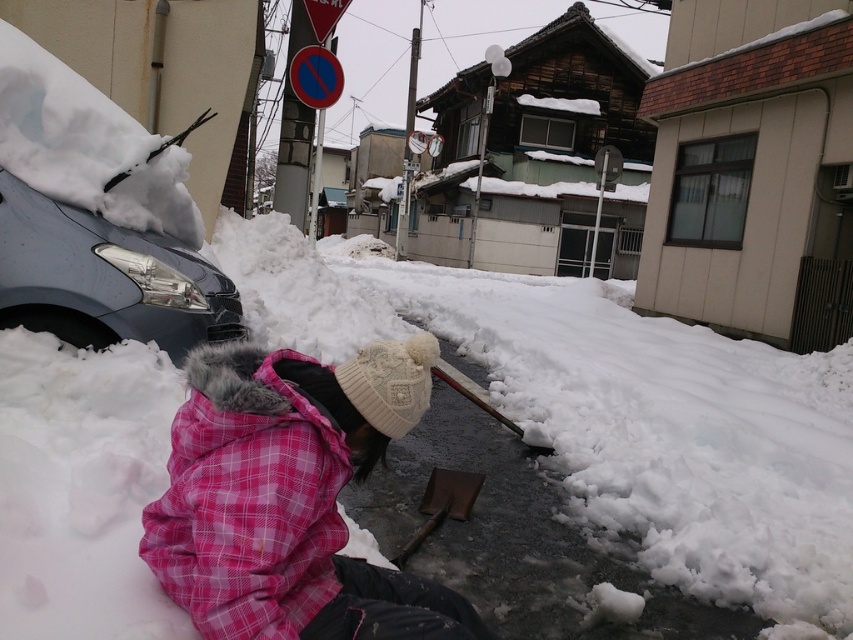
Is white fluffy snow at center above pink fleece jacket at lower left?

Yes.

Is point (152, 362) positioned behind point (231, 435)?

That is True.

Where is `white fluffy snow at center`? The width and height of the screenshot is (853, 640). white fluffy snow at center is located at coordinates (612, 410).

Is point (161, 282) closer to camera compared to point (445, 508)?

No, it is not.

Can you confirm if matte gray car at left is bigger than wooden shovel at center?

Indeed, matte gray car at left has a larger size compared to wooden shovel at center.

Measure the distance between point [184,326] and camera.

Point [184,326] is 4.07 meters away from camera.

Identify the location of matte gray car at left. (105, 278).

Is pink fleece jacket at lower left positioned at the back of wooden shovel at center?

No.

Does point (364, 564) lie behind point (427, 532)?

That is False.

The height and width of the screenshot is (640, 853). In order to click on pink fleece jacket at lower left in this screenshot , I will do `click(289, 497)`.